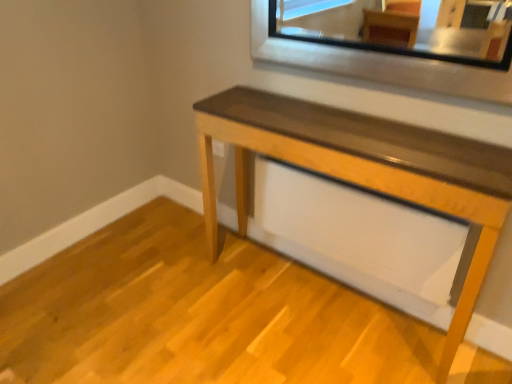
Image resolution: width=512 pixels, height=384 pixels. What are the coordinates of `vacant space to the left of wooden table at lower right` in the screenshot? It's located at (169, 274).